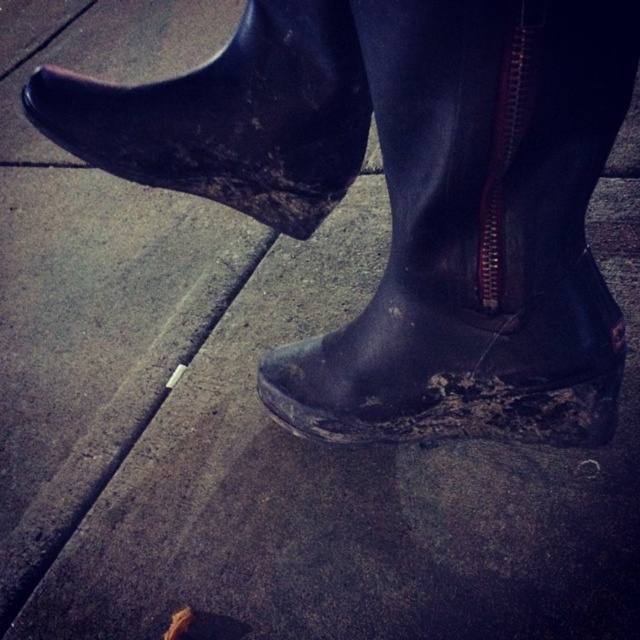
Question: Which point is closer to the camera?

Choices:
 (A) (337, 186)
 (B) (548, 282)
 (C) (8, 576)

Answer: (B)

Question: Can you confirm if muddy rubber boot at center is thinner than muddy rubber boot at upper left?

Choices:
 (A) yes
 (B) no

Answer: (B)

Question: Which of the following is the closest to the observer?

Choices:
 (A) gray concrete curb at lower left
 (B) muddy rubber boot at upper left
 (C) muddy rubber boot at center

Answer: (B)

Question: Based on their relative distances, which object is nearer to the muddy rubber boot at upper left?

Choices:
 (A) muddy rubber boot at center
 (B) gray concrete curb at lower left

Answer: (A)

Question: Considering the relative positions of muddy rubber boot at upper left and gray concrete curb at lower left in the image provided, where is muddy rubber boot at upper left located with respect to gray concrete curb at lower left?

Choices:
 (A) below
 (B) above

Answer: (B)

Question: Considering the relative positions of muddy rubber boot at center and gray concrete curb at lower left in the image provided, where is muddy rubber boot at center located with respect to gray concrete curb at lower left?

Choices:
 (A) below
 (B) above

Answer: (B)